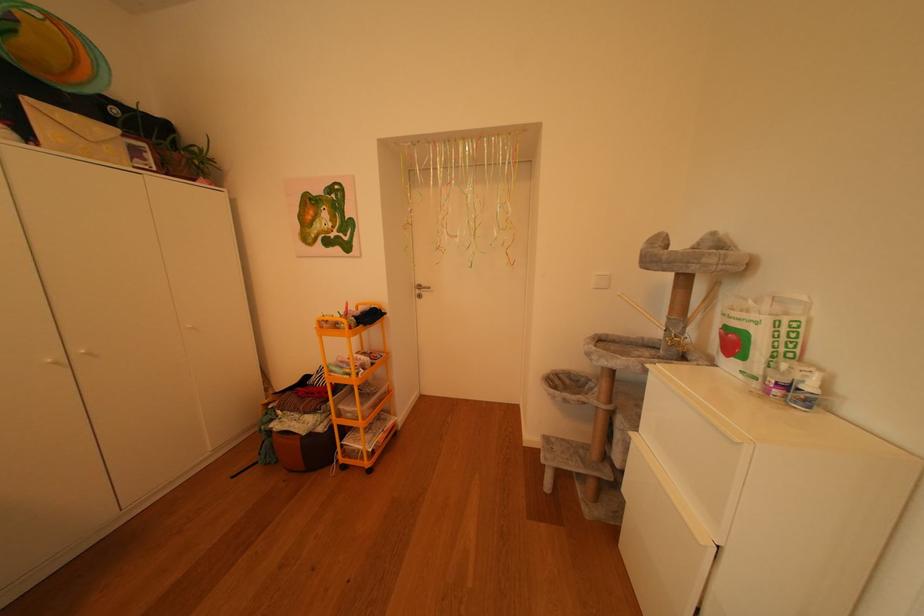
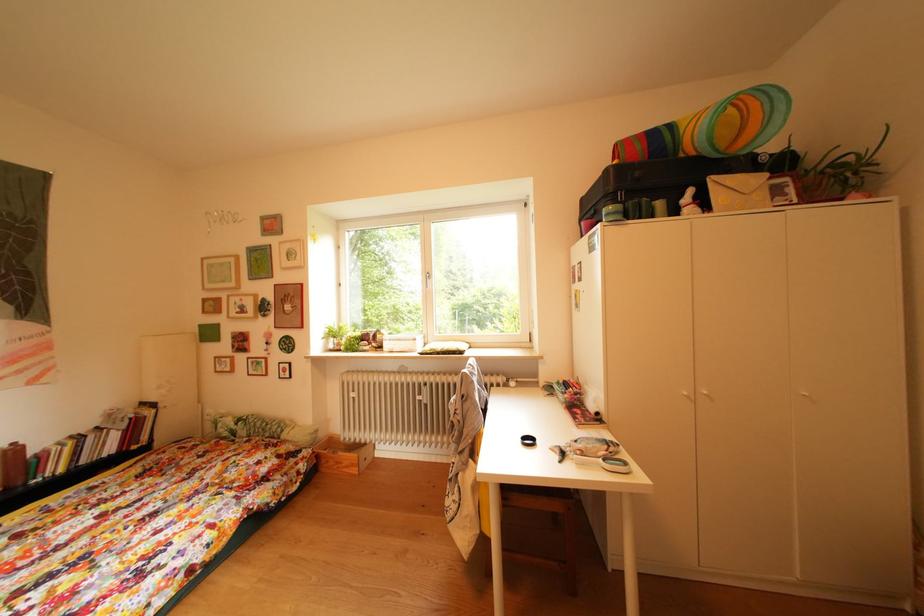
Question: The first image is from the beginning of the video and the second image is from the end. How did the camera likely rotate when shooting the video?

Choices:
 (A) Left
 (B) Right
 (C) Up
 (D) Down

Answer: (A)